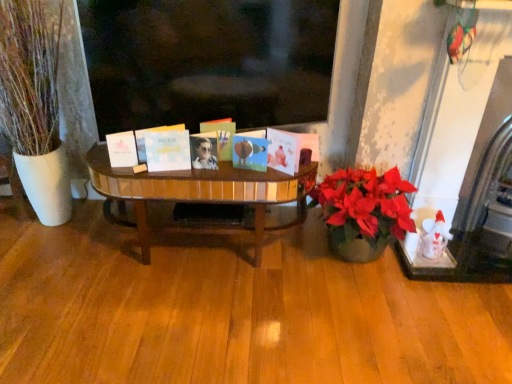
Describe the element at coordinates (283, 151) in the screenshot. I see `white matte book at center, the first book from the right` at that location.

What do you see at coordinates (221, 136) in the screenshot?
I see `metallic photo album at center, positioned as the third book in right-to-left order` at bounding box center [221, 136].

What do you see at coordinates (463, 154) in the screenshot? I see `white marble fireplace at right` at bounding box center [463, 154].

Locate an element on the screen. white matte book at center, the first book from the right is located at coordinates (283, 151).

Which is farther from the camera, (443,151) or (167,161)?

Point (443,151)

From the image's perspective, between white marble fireplace at right and white matte card at center, positioned as the second book in left-to-right order, who is located below?

From the image's view, white matte card at center, positioned as the second book in left-to-right order, is below.

From a real-world perspective, is white marble fireplace at right on white matte card at center, positioned as the second book in left-to-right order?

No, from a real-world perspective, white marble fireplace at right is not above white matte card at center, positioned as the second book in left-to-right order.

Which of these two, white marble fireplace at right or white matte card at center, the 4th book from the right, is bigger?

white marble fireplace at right.

Do you think white matte card at center, the 4th book from the right, is within matte black sunglasses at center, or outside of it?

white matte card at center, the 4th book from the right, is located beyond the bounds of matte black sunglasses at center.

Based on the photo, does white matte card at center, the 4th book from the right, turn towards matte black sunglasses at center?

No, white matte card at center, the 4th book from the right, is not oriented towards matte black sunglasses at center.

From a real-world perspective, is white matte card at center, positioned as the second book in left-to-right order, located higher than matte black sunglasses at center?

Yes, from a real-world perspective, white matte card at center, positioned as the second book in left-to-right order, is over matte black sunglasses at center

Is white matte card at center, positioned as the second book in left-to-right order, positioned behind matte black sunglasses at center?

No, white matte card at center, positioned as the second book in left-to-right order, is in front of matte black sunglasses at center.

From the picture: Does white matte book at center, the first book from the right, have a lesser height compared to metallic photo album at center, placed as the 3th book when sorted from left to right?

Yes.

Which object is wider, white matte book at center, the fifth book viewed from the left, or metallic photo album at center, positioned as the third book in right-to-left order?

metallic photo album at center, positioned as the third book in right-to-left order, is wider.

Is white matte book at center, the fifth book viewed from the left, positioned behind metallic photo album at center, positioned as the third book in right-to-left order?

No, it is in front of metallic photo album at center, positioned as the third book in right-to-left order.

Visually, is white matte book at center, the fifth book viewed from the left, positioned to the left or to the right of white matte book at left, acting as the fifth book starting from the right?

white matte book at center, the fifth book viewed from the left, is to the right of white matte book at left, acting as the fifth book starting from the right.

In terms of size, does white matte book at center, the fifth book viewed from the left, appear bigger or smaller than white matte book at left, marked as the 1th book in a left-to-right arrangement?

Clearly, white matte book at center, the fifth book viewed from the left, is larger in size than white matte book at left, marked as the 1th book in a left-to-right arrangement.

Considering the positions of objects white matte book at center, the first book from the right, and white matte book at left, marked as the 1th book in a left-to-right arrangement, in the image provided, who is in front, white matte book at center, the first book from the right, or white matte book at left, marked as the 1th book in a left-to-right arrangement,?

white matte book at center, the first book from the right, is more forward.

Is white matte book at center, the fifth book viewed from the left, surrounding white matte book at left, acting as the fifth book starting from the right?

No, white matte book at left, acting as the fifth book starting from the right, is not surrounded by white matte book at center, the fifth book viewed from the left.

Is point (127, 148) closer to camera compared to point (440, 168)?

Yes, it is.

From the image's perspective, relative to white marble fireplace at right, is white matte book at left, marked as the 1th book in a left-to-right arrangement, above or below?

white matte book at left, marked as the 1th book in a left-to-right arrangement, is situated lower than white marble fireplace at right in the image.

Is white matte book at left, marked as the 1th book in a left-to-right arrangement, located outside white marble fireplace at right?

Indeed, white matte book at left, marked as the 1th book in a left-to-right arrangement, is completely outside white marble fireplace at right.

The width and height of the screenshot is (512, 384). I want to click on fireplace below the white matte book at left, marked as the 1th book in a left-to-right arrangement (from a real-world perspective), so click(463, 154).

In terms of height, does white marble fireplace at right look taller or shorter compared to white matte book at left, marked as the 1th book in a left-to-right arrangement?

white marble fireplace at right is taller than white matte book at left, marked as the 1th book in a left-to-right arrangement.

Are white marble fireplace at right and white matte book at left, marked as the 1th book in a left-to-right arrangement, far apart?

Yes, white marble fireplace at right and white matte book at left, marked as the 1th book in a left-to-right arrangement, are located far from each other.

Is point (495, 62) closer to camera compared to point (131, 143)?

Yes, it is.

Is matte black sunglasses at center not near white matte book at left, marked as the 1th book in a left-to-right arrangement?

No, matte black sunglasses at center is not far away from white matte book at left, marked as the 1th book in a left-to-right arrangement.

Is matte black sunglasses at center oriented towards white matte book at left, acting as the fifth book starting from the right?

No.

Which object is wider, matte black sunglasses at center or white matte book at left, marked as the 1th book in a left-to-right arrangement?

With larger width is matte black sunglasses at center.

How different are the orientations of matte black sunglasses at center and white matte book at left, marked as the 1th book in a left-to-right arrangement, in degrees?

The angular difference between matte black sunglasses at center and white matte book at left, marked as the 1th book in a left-to-right arrangement, is 16.8 degrees.

From the image's perspective, which book is the 1st one below the white marble fireplace at right? Please provide its 2D coordinates.

[(167, 150)]

Find the location of a particular element. the 4th book in front of the matte black sunglasses at center, counting from the anchor's position is located at coordinates (167, 150).

Based on their spatial positions, is matte blue card at center, arranged as the 2th book when viewed from the right, or white marble fireplace at right further from white matte card at center, the 4th book from the right?

The object further to white matte card at center, the 4th book from the right, is white marble fireplace at right.

Looking at the image, which one is located closer to white matte book at left, marked as the 1th book in a left-to-right arrangement, white matte book at center, the fifth book viewed from the left, or matte blue card at center, arranged as the 4th book when viewed from the left?

matte blue card at center, arranged as the 4th book when viewed from the left, lies closer to white matte book at left, marked as the 1th book in a left-to-right arrangement, than the other object.

Based on their spatial positions, is metallic photo album at center, placed as the 3th book when sorted from left to right, or white matte book at left, acting as the fifth book starting from the right, closer to matte blue card at center, arranged as the 4th book when viewed from the left?

Among the two, metallic photo album at center, placed as the 3th book when sorted from left to right, is located nearer to matte blue card at center, arranged as the 4th book when viewed from the left.

Estimate the real-world distances between objects in this image. Which object is further from white matte book at left, acting as the fifth book starting from the right, white marble fireplace at right or metallic photo album at center, positioned as the third book in right-to-left order?

white marble fireplace at right is further to white matte book at left, acting as the fifth book starting from the right.

Based on their spatial positions, is white marble fireplace at right or metallic photo album at center, positioned as the third book in right-to-left order, closer to matte black sunglasses at center?

Based on the image, metallic photo album at center, positioned as the third book in right-to-left order, appears to be nearer to matte black sunglasses at center.

Looking at the image, which one is located further to matte black sunglasses at center, white marble fireplace at right or white matte book at left, marked as the 1th book in a left-to-right arrangement?

Among the two, white marble fireplace at right is located further to matte black sunglasses at center.

Based on their spatial positions, is matte black sunglasses at center or matte blue card at center, arranged as the 4th book when viewed from the left, closer to metallic photo album at center, placed as the 3th book when sorted from left to right?

matte black sunglasses at center is positioned closer to the anchor metallic photo album at center, placed as the 3th book when sorted from left to right.

Which object lies further to the anchor point matte blue card at center, arranged as the 2th book when viewed from the right, metallic photo album at center, positioned as the third book in right-to-left order, or white marble fireplace at right?

The object further to matte blue card at center, arranged as the 2th book when viewed from the right, is white marble fireplace at right.

The width and height of the screenshot is (512, 384). Find the location of `person between white matte book at left, marked as the 1th book in a left-to-right arrangement, and matte blue card at center, arranged as the 2th book when viewed from the right, from left to right`. person between white matte book at left, marked as the 1th book in a left-to-right arrangement, and matte blue card at center, arranged as the 2th book when viewed from the right, from left to right is located at coordinates click(204, 155).

Image resolution: width=512 pixels, height=384 pixels. Identify the location of book between matte black sunglasses at center and matte blue card at center, arranged as the 4th book when viewed from the left, in the horizontal direction. (221, 136).

The width and height of the screenshot is (512, 384). Find the location of `person between white matte card at center, the 4th book from the right, and matte blue card at center, arranged as the 4th book when viewed from the left`. person between white matte card at center, the 4th book from the right, and matte blue card at center, arranged as the 4th book when viewed from the left is located at coordinates (204, 155).

The image size is (512, 384). I want to click on person between white matte card at center, positioned as the second book in left-to-right order, and white matte book at center, the fifth book viewed from the left, in the horizontal direction, so click(204, 155).